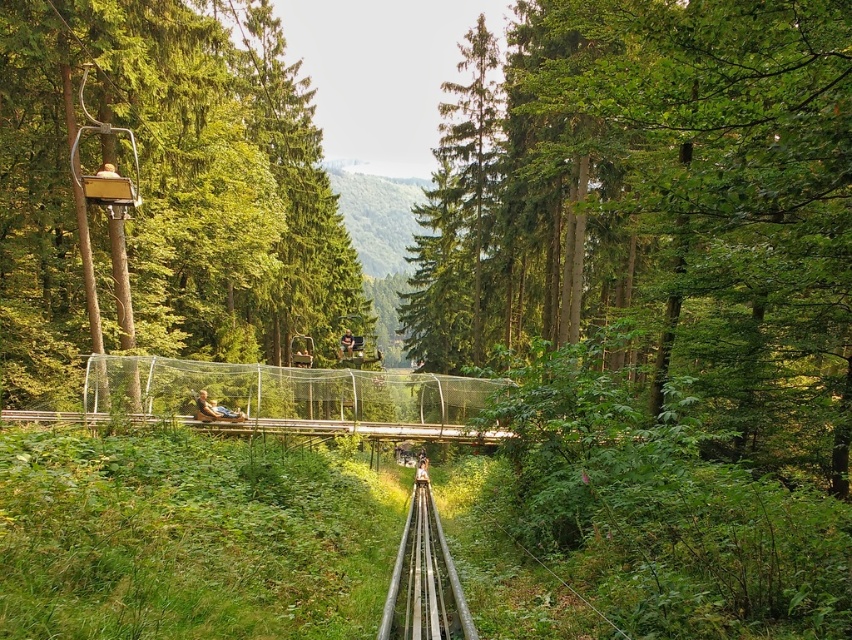
You are standing on the wooden bench at center and want to look at the green leafy tree at center. Is the tree blocking your view of the suspension bridge behind it?

The green leafy tree at center is in front of the wooden bench at center, so the tree is between you and the suspension bridge. This means the tree would block your view of the suspension bridge behind it.

You are standing at the suspension bridge and want to take a photo of both point (337, 284) and point (226, 412) in the scene. Which point will appear closer to the bottom edge of your camera viewfinder?

Point (226, 412) will appear closer to the bottom edge of the camera viewfinder because it is closer to the camera than point (337, 284).

You are standing at the origin point of the image, which is the bottom left corner. You want to walk towards the green leafy tree at center. In which direction should you move relative to your current position?

The green leafy tree at center is located at point (x=661, y=212), so you should move northeast to reach it from the bottom left corner.